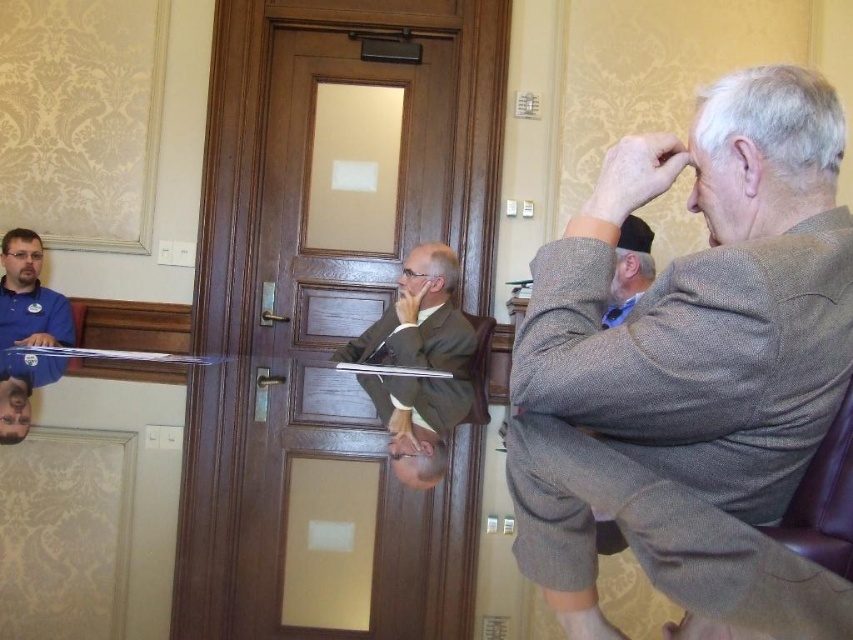
Question: Is wooden door at center to the right of matte blue shirt at left from the viewer's perspective?

Choices:
 (A) yes
 (B) no

Answer: (A)

Question: Which of the following is the farthest from the observer?

Choices:
 (A) blue fabric cap at upper right
 (B) matte blue shirt at left
 (C) brown leather chair at lower right

Answer: (B)

Question: Is wooden door at center positioned behind brown leather chair at lower right?

Choices:
 (A) no
 (B) yes

Answer: (B)

Question: Which point is farther to the camera?

Choices:
 (A) (270, 433)
 (B) (22, 289)
 (C) (798, 508)

Answer: (B)

Question: Which of the following is the closest to the observer?

Choices:
 (A) (786, 536)
 (B) (398, 458)

Answer: (A)

Question: Is brown leather chair at lower right positioned before matte blue shirt at left?

Choices:
 (A) yes
 (B) no

Answer: (A)